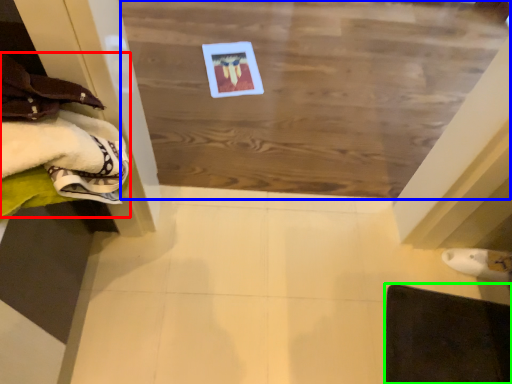
Question: Considering the real-world distances, which object is closest to clothing (highlighted by a red box)? plywood (highlighted by a blue box) or furniture (highlighted by a green box).

Choices:
 (A) plywood
 (B) furniture

Answer: (A)